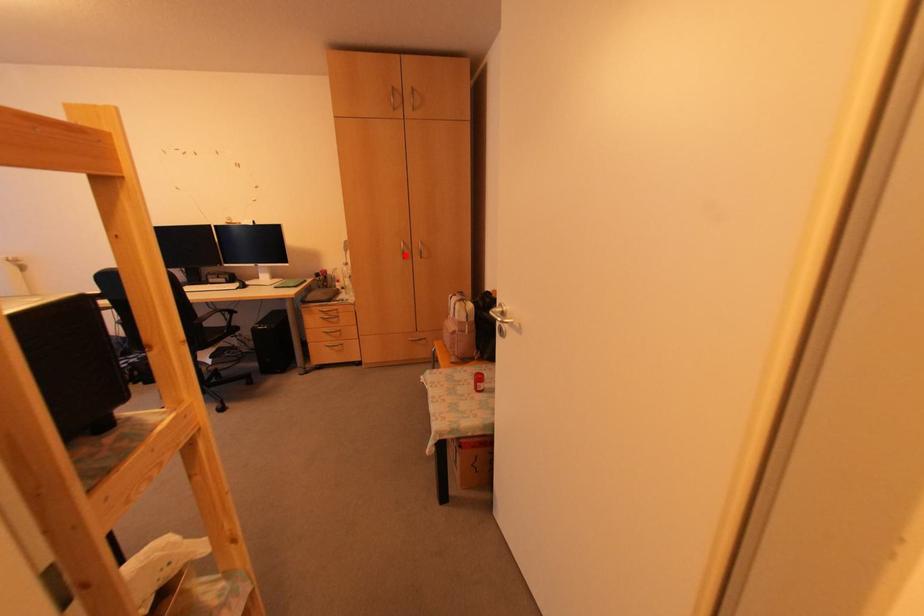
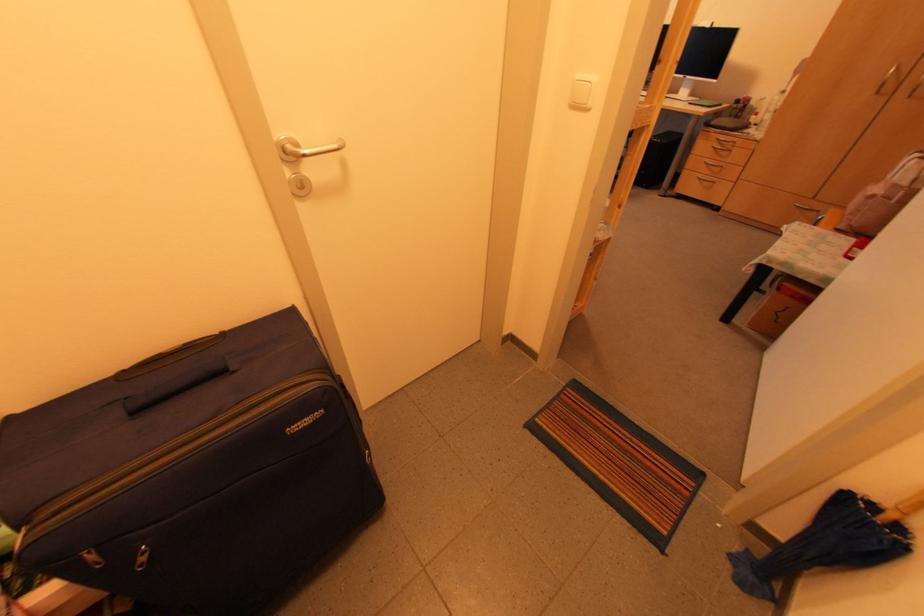
Where in the second image is the point corresponding to the highlighted location from the first image?

(886, 87)